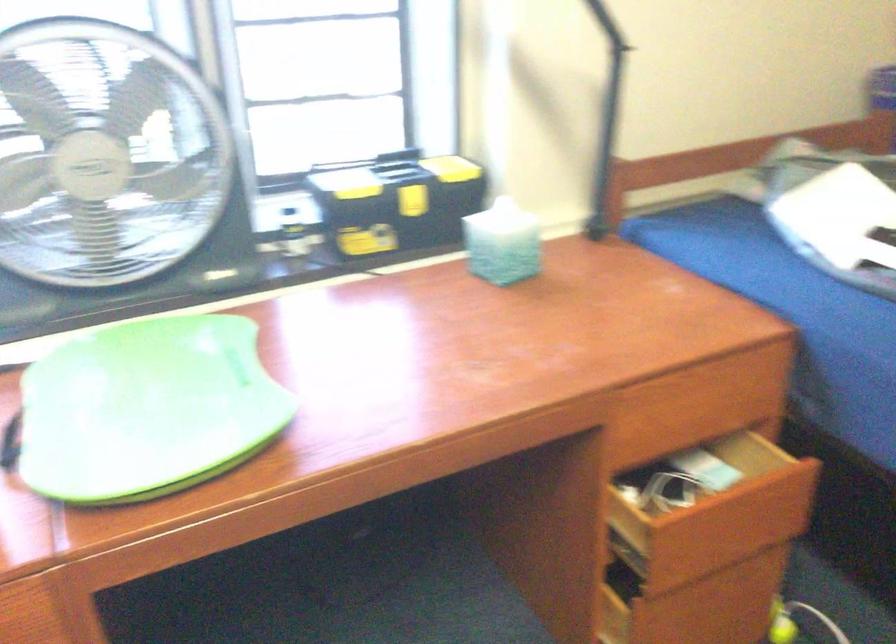
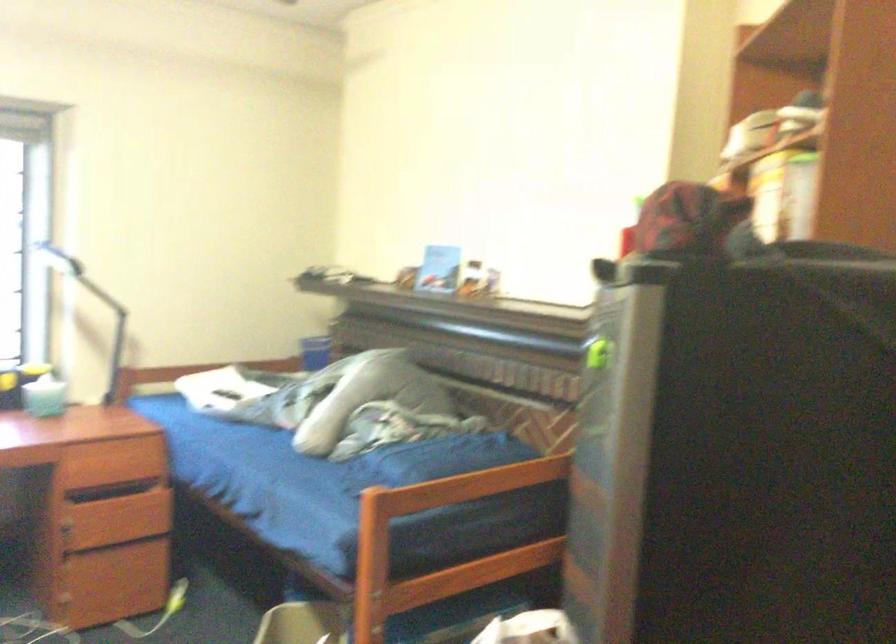
Which direction would the cameraman need to move to produce the second image?

The cameraman moved toward right, backward.